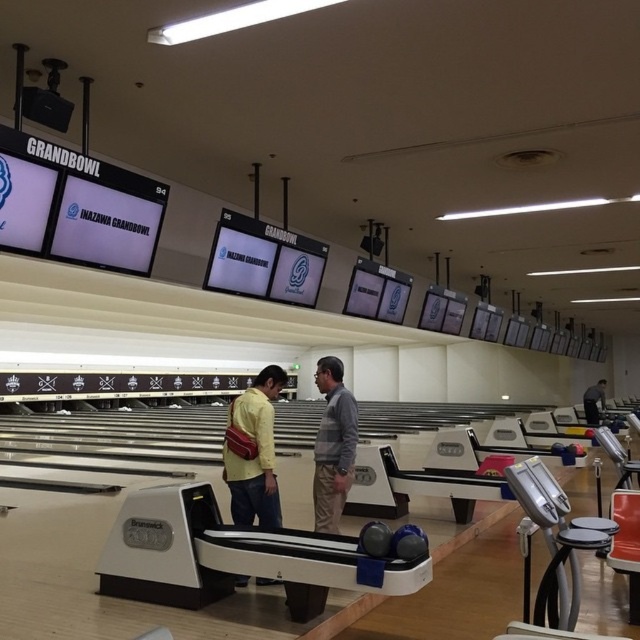
Question: Which object is the farthest from the yellow matte shirt at center?

Choices:
 (A) light brown leather jacket at center
 (B) gray sweater at center

Answer: (A)

Question: Can you confirm if yellow matte shirt at center is positioned to the right of gray sweater at center?

Choices:
 (A) no
 (B) yes

Answer: (A)

Question: Among these objects, which one is nearest to the camera?

Choices:
 (A) light brown leather jacket at center
 (B) gray sweater at center

Answer: (B)

Question: Does yellow matte shirt at center appear on the right side of light brown leather jacket at center?

Choices:
 (A) no
 (B) yes

Answer: (A)

Question: Does yellow matte shirt at center appear on the left side of light brown leather jacket at center?

Choices:
 (A) yes
 (B) no

Answer: (A)

Question: Which object appears farthest from the camera in this image?

Choices:
 (A) yellow matte shirt at center
 (B) gray sweater at center

Answer: (B)